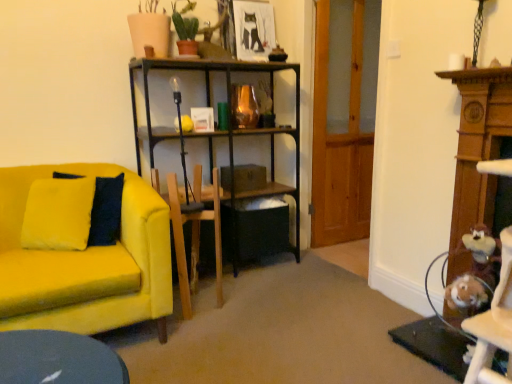
Question: Can you confirm if transparent wooden door at center is wider than velvet yellow couch at left?

Choices:
 (A) no
 (B) yes

Answer: (A)

Question: Is transparent wooden door at center positioned far away from velvet yellow couch at left?

Choices:
 (A) no
 (B) yes

Answer: (B)

Question: Is the depth of transparent wooden door at center greater than that of velvet yellow couch at left?

Choices:
 (A) no
 (B) yes

Answer: (B)

Question: Can we say transparent wooden door at center lies outside velvet yellow couch at left?

Choices:
 (A) yes
 (B) no

Answer: (A)

Question: Is transparent wooden door at center smaller than velvet yellow couch at left?

Choices:
 (A) no
 (B) yes

Answer: (B)

Question: Is point (238, 6) closer or farther from the camera than point (193, 173)?

Choices:
 (A) farther
 (B) closer

Answer: (A)

Question: In terms of size, does matte black picture frame at upper center appear bigger or smaller than wooden swivel chair at center?

Choices:
 (A) big
 (B) small

Answer: (B)

Question: From the image's perspective, is matte black picture frame at upper center located above or below wooden swivel chair at center?

Choices:
 (A) below
 (B) above

Answer: (B)

Question: In the image, is matte black picture frame at upper center positioned in front of or behind wooden swivel chair at center?

Choices:
 (A) behind
 (B) front

Answer: (A)

Question: From the image's perspective, is transparent wooden door at center above or below velvet yellow couch at left?

Choices:
 (A) above
 (B) below

Answer: (A)

Question: In the image, is transparent wooden door at center positioned in front of or behind velvet yellow couch at left?

Choices:
 (A) behind
 (B) front

Answer: (A)

Question: Does point (353, 79) appear closer or farther from the camera than point (130, 284)?

Choices:
 (A) farther
 (B) closer

Answer: (A)

Question: Is transparent wooden door at center to the left or to the right of velvet yellow couch at left in the image?

Choices:
 (A) right
 (B) left

Answer: (A)

Question: From a real-world perspective, is wooden swivel chair at center positioned above or below transparent wooden door at center?

Choices:
 (A) below
 (B) above

Answer: (A)

Question: Is wooden swivel chair at center bigger or smaller than transparent wooden door at center?

Choices:
 (A) big
 (B) small

Answer: (B)